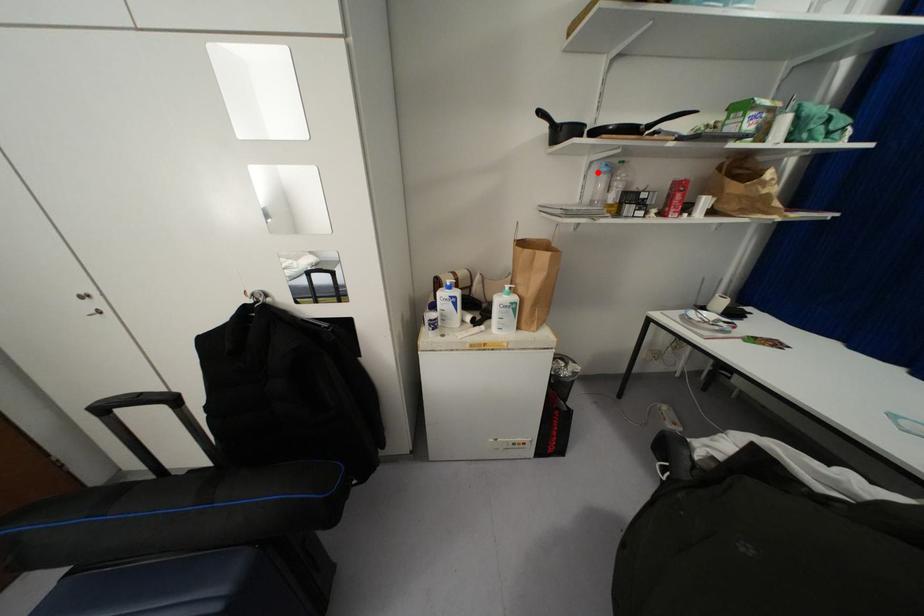
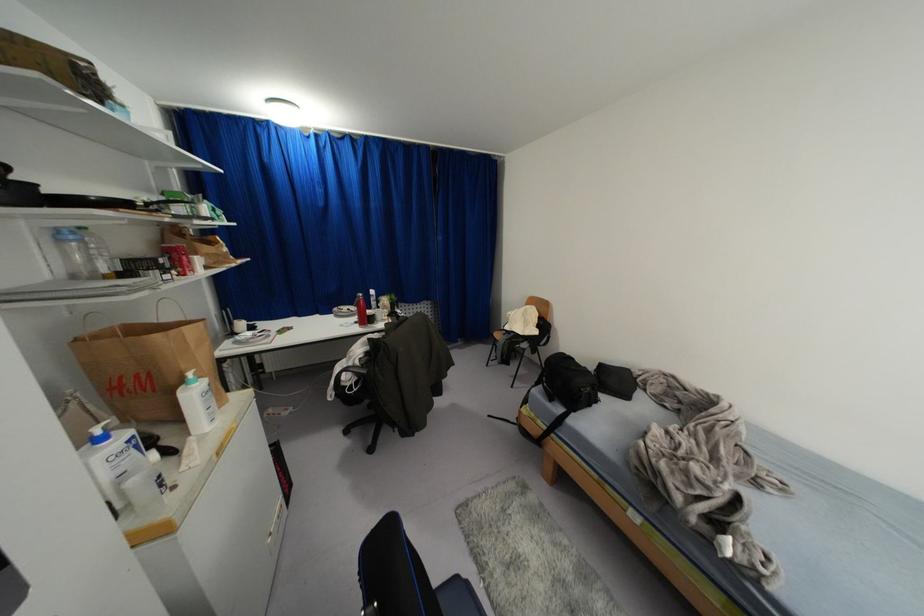
Question: I am providing you with two images of the same scene from different viewpoints. A red point is shown in image1. For the corresponding object point in image2, is it positioned nearer or farther from the camera?

Choices:
 (A) Nearer
 (B) Farther

Answer: (B)